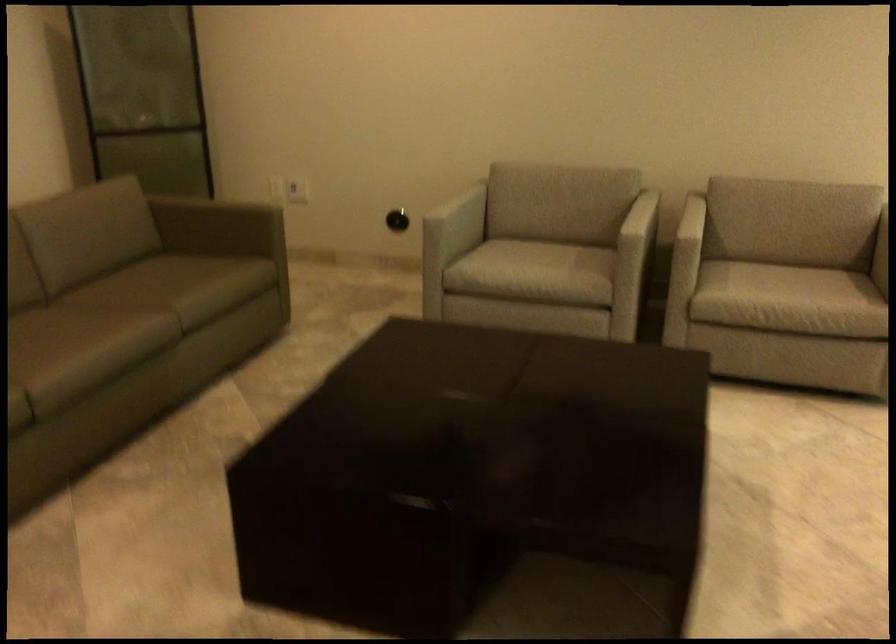
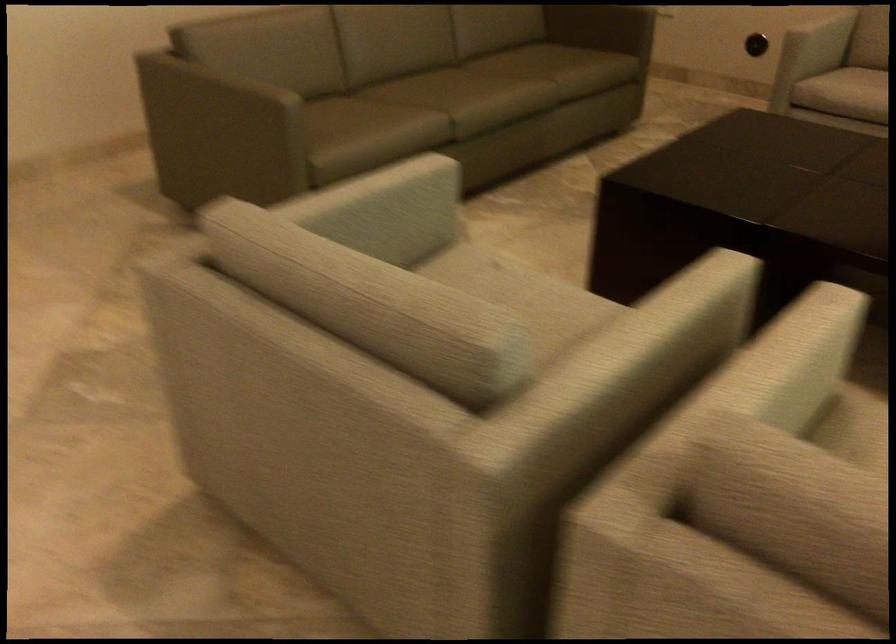
The point at (461, 210) is marked in the first image. Where is the corresponding point in the second image?

(821, 35)